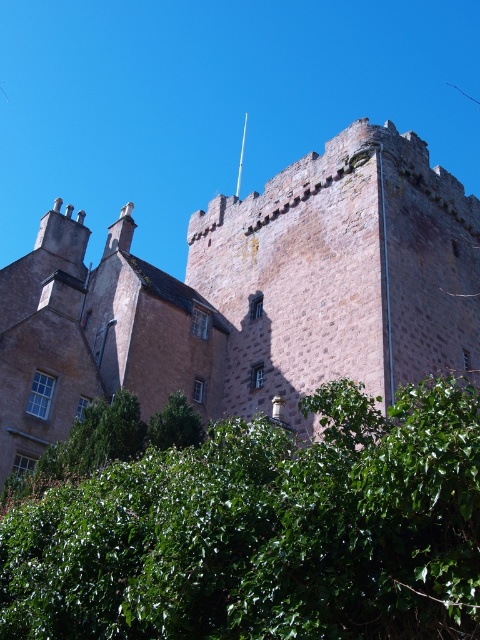
Who is lower down, brown stone tower at upper center or green leafy tree at lower center?

green leafy tree at lower center is lower down.

Which is behind, point (86, 397) or point (192, 436)?

The point (86, 397) is behind.

Image resolution: width=480 pixels, height=640 pixels. Identify the location of brown stone tower at upper center. (249, 296).

Between green leafy bush at lower center and green leafy tree at lower center, which one appears on the right side from the viewer's perspective?

From the viewer's perspective, green leafy bush at lower center appears more on the right side.

Is point (432, 620) farther from viewer compared to point (194, 412)?

No, (432, 620) is closer to viewer.

Is point (118, 504) in front of point (176, 394)?

That is True.

The image size is (480, 640). In order to click on green leafy bush at lower center in this screenshot , I will do `click(264, 531)`.

Locate an element on the screen. brown stone tower at upper center is located at coordinates (249, 296).

Is point (60, 323) positioned after point (316, 582)?

Yes, point (60, 323) is behind point (316, 582).

Which is in front, point (264, 276) or point (291, 493)?

Point (291, 493) is in front.

In order to click on brown stone tower at upper center in this screenshot , I will do `click(249, 296)`.